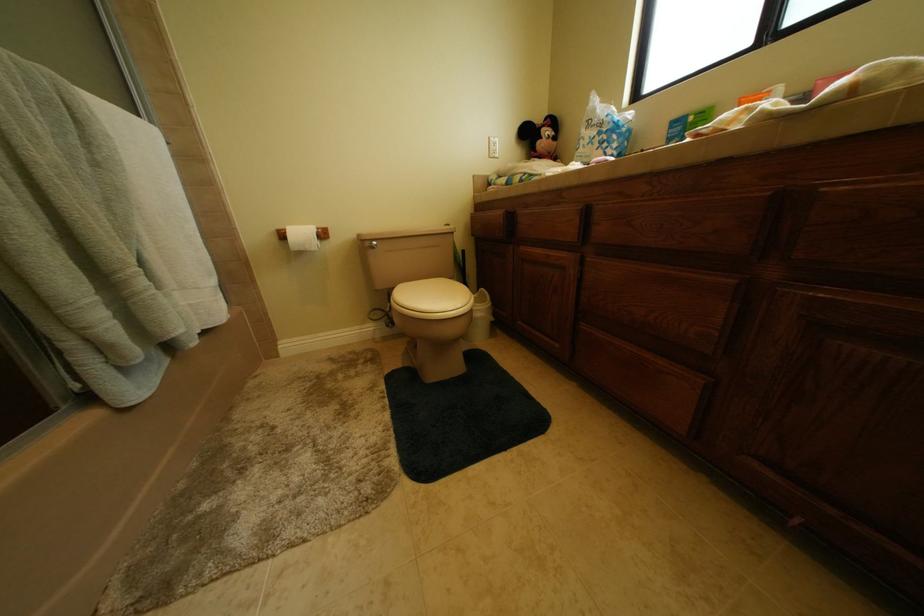
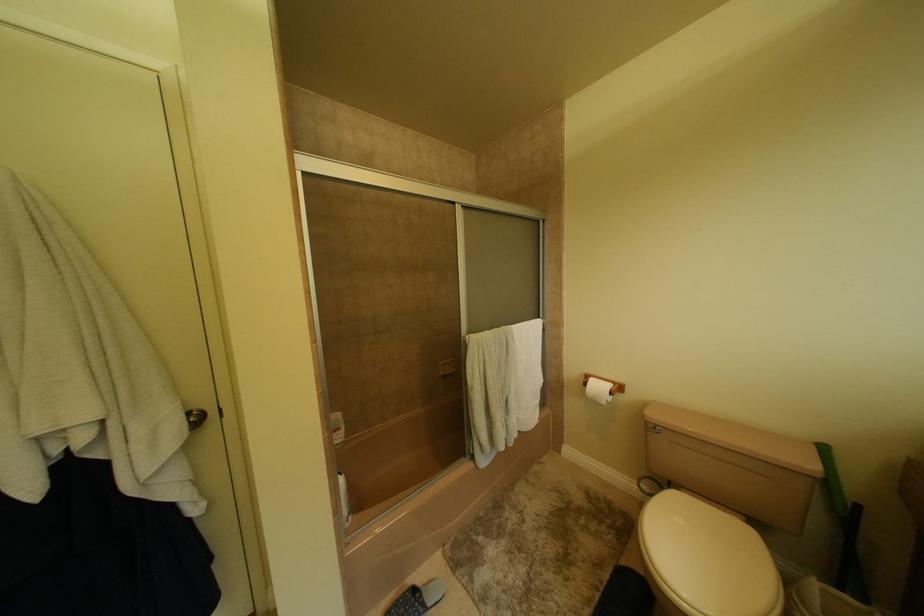
Question: The images are taken continuously from a first-person perspective. In which direction is your viewpoint rotating?

Choices:
 (A) Left
 (B) Right
 (C) Up
 (D) Down

Answer: (A)